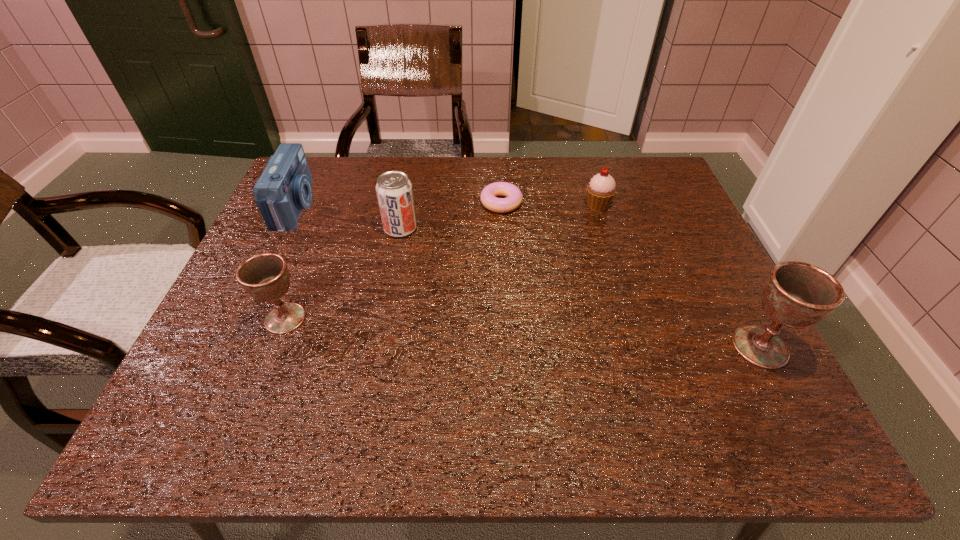
I want to click on object that is the third closest to the shorter chalice, so click(489, 194).

You are a GUI agent. You are given a task and a screenshot of the screen. Output one action in this format:
    pyautogui.click(x=<x>, y=<y>)
    Task: Click on the vacant point that satisfies the following two spatial constraints: 1. on the lens of the third object from left to right; 2. on the left side of the camera
    The height and width of the screenshot is (540, 960).
    Given the screenshot: What is the action you would take?
    pyautogui.click(x=285, y=228)

Image resolution: width=960 pixels, height=540 pixels. Find the location of `blank space that satisfies the following two spatial constraints: 1. on the lens of the camera; 2. on the back side of the soda can`. blank space that satisfies the following two spatial constraints: 1. on the lens of the camera; 2. on the back side of the soda can is located at coordinates 285,228.

Locate an element on the screen. Image resolution: width=960 pixels, height=540 pixels. vacant space that satisfies the following two spatial constraints: 1. on the lens of the leftmost object; 2. on the right side of the third object from left to right is located at coordinates (285, 228).

The image size is (960, 540). I want to click on vacant space that satisfies the following two spatial constraints: 1. on the front side of the shortest object; 2. on the left side of the second object from right to left, so click(501, 205).